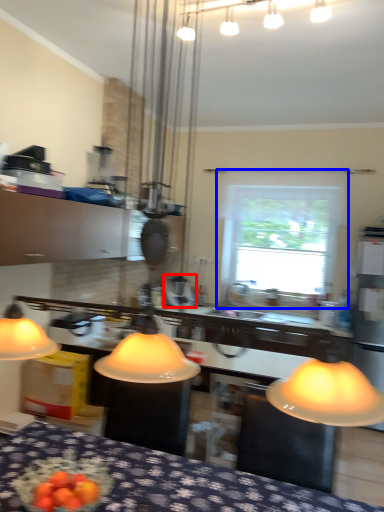
Question: Which of the following is the farthest to the observer, appliance (highlighted by a red box) or window (highlighted by a blue box)?

Choices:
 (A) appliance
 (B) window

Answer: (B)